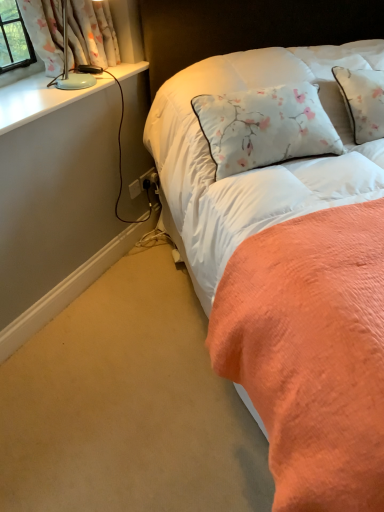
Question: Is white floral fabric at upper left wider or thinner than floral fabric pillow at upper right?

Choices:
 (A) thin
 (B) wide

Answer: (A)

Question: Is white floral fabric at upper left in front of or behind floral fabric pillow at upper right in the image?

Choices:
 (A) front
 (B) behind

Answer: (B)

Question: Considering the real-world distances, which object is closest to the floral fabric pillow at upper right?

Choices:
 (A) white glossy window sill at upper left
 (B) white plastic power outlet at lower center
 (C) white floral fabric at upper left
 (D) white plastic electrical outlet at lower center

Answer: (A)

Question: Estimate the real-world distances between objects in this image. Which object is farther from the white plastic power outlet at lower center?

Choices:
 (A) white floral fabric at upper left
 (B) white glossy window sill at upper left
 (C) white plastic electrical outlet at lower center
 (D) floral fabric pillow at upper right

Answer: (D)